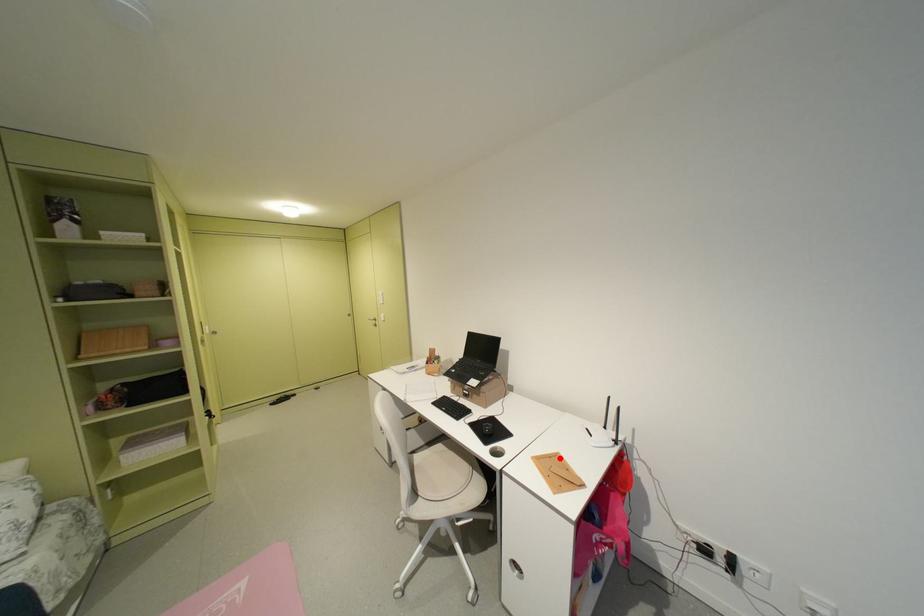
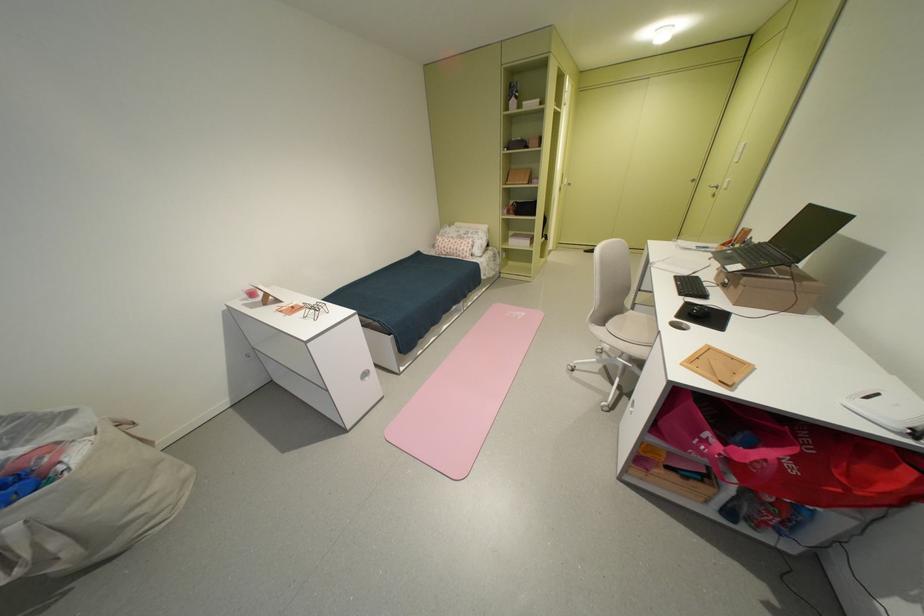
The point at the highlighted location is marked in the first image. Where is the corresponding point in the second image?

(743, 360)